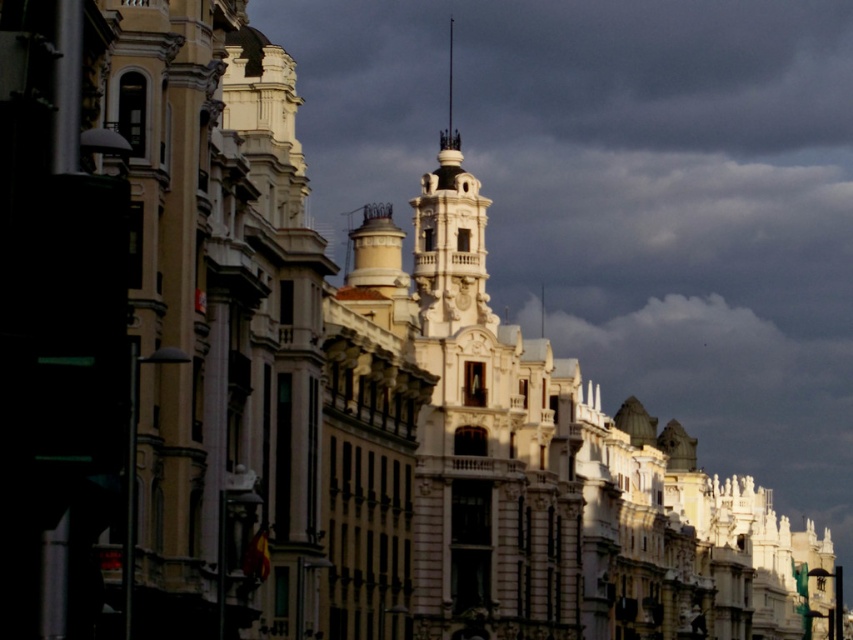
You are standing at the center of the street in front of the central building. Where is the metallic streetlight at left located relative to your position?

The metallic streetlight at left is located at point (56, 320) relative to your position.